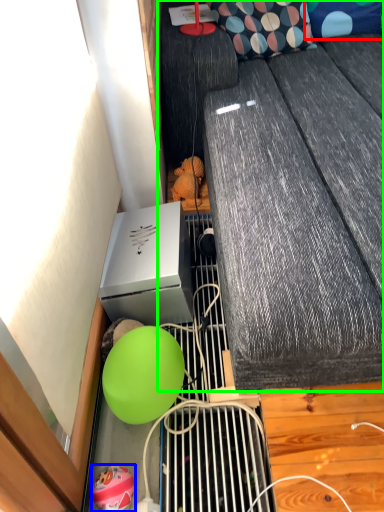
Question: Considering the real-world distances, which object is farthest from pillow (highlighted by a red box)? balloon (highlighted by a blue box) or furniture (highlighted by a green box)?

Choices:
 (A) balloon
 (B) furniture

Answer: (A)